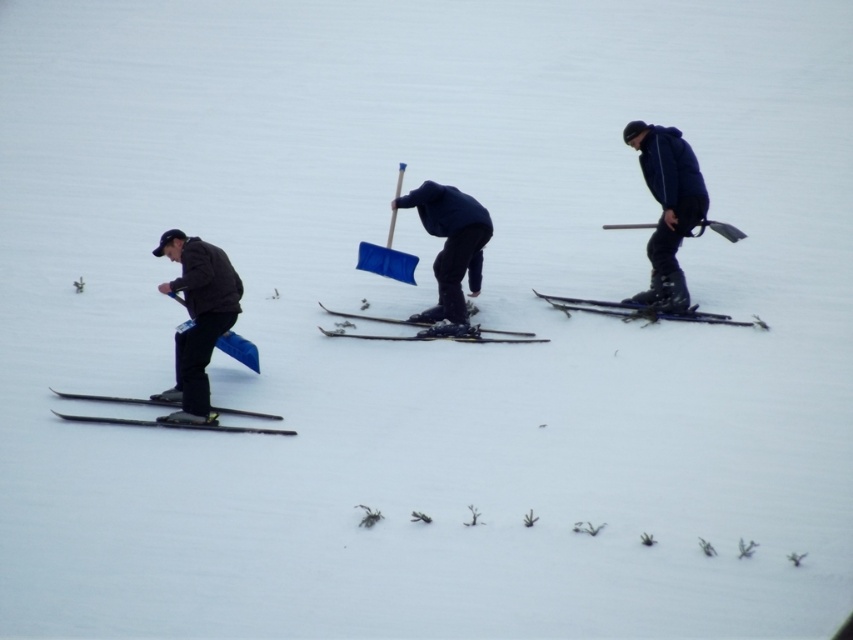
Which is more to the right, dark brown jacket at left or matte black skis at center?

From the viewer's perspective, matte black skis at center appears more on the right side.

Is dark brown jacket at left above matte black skis at center?

Yes.

From the picture: Who is more forward, [175,365] or [519,339]?

Point [175,365] is more forward.

Identify the location of dark brown jacket at left. This screenshot has width=853, height=640. (196, 317).

Who is positioned more to the right, blue plastic shovel at center or matte black ski at center?

Positioned to the right is blue plastic shovel at center.

Is point (438, 204) in front of point (416, 336)?

No, (438, 204) is behind (416, 336).

This screenshot has height=640, width=853. Identify the location of blue plastic shovel at center. (450, 248).

Identify the location of blue plastic shovel at center. (450, 248).

Describe the element at coordinates (643, 310) in the screenshot. I see `shiny black skis at right` at that location.

Is shiny black skis at right wider than matte black skis at center?

Correct, the width of shiny black skis at right exceeds that of matte black skis at center.

Which is in front, point (722, 321) or point (352, 317)?

Point (722, 321) is more forward.

This screenshot has width=853, height=640. I want to click on shiny black skis at right, so click(643, 310).